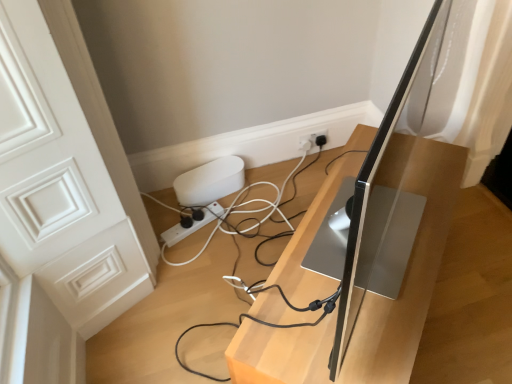
Question: Considering the relative sizes of silver metallic monitor at center and white plastic power strip at lower center in the image provided, is silver metallic monitor at center wider than white plastic power strip at lower center?

Choices:
 (A) yes
 (B) no

Answer: (A)

Question: From a real-world perspective, is silver metallic monitor at center physically above white plastic power strip at lower center?

Choices:
 (A) no
 (B) yes

Answer: (B)

Question: Is silver metallic monitor at center at the right side of white plastic power strip at lower center?

Choices:
 (A) no
 (B) yes

Answer: (B)

Question: Does silver metallic monitor at center lie behind white plastic power strip at lower center?

Choices:
 (A) yes
 (B) no

Answer: (B)

Question: From the image's perspective, is silver metallic monitor at center beneath white plastic power strip at lower center?

Choices:
 (A) yes
 (B) no

Answer: (A)

Question: Is silver metallic monitor at center at the left side of white plastic power strip at lower center?

Choices:
 (A) no
 (B) yes

Answer: (A)

Question: Can you confirm if silver metallic computer monitor at center is taller than silver metallic monitor at center?

Choices:
 (A) no
 (B) yes

Answer: (B)

Question: From the image's perspective, is silver metallic computer monitor at center on top of silver metallic monitor at center?

Choices:
 (A) yes
 (B) no

Answer: (A)

Question: Can we say silver metallic computer monitor at center lies outside silver metallic monitor at center?

Choices:
 (A) yes
 (B) no

Answer: (A)

Question: From a real-world perspective, is silver metallic computer monitor at center physically above silver metallic monitor at center?

Choices:
 (A) yes
 (B) no

Answer: (A)

Question: Is silver metallic computer monitor at center oriented towards silver metallic monitor at center?

Choices:
 (A) no
 (B) yes

Answer: (A)

Question: Considering the relative sizes of silver metallic computer monitor at center and silver metallic monitor at center in the image provided, is silver metallic computer monitor at center smaller than silver metallic monitor at center?

Choices:
 (A) no
 (B) yes

Answer: (B)

Question: From the image's perspective, is silver metallic monitor at center located above silver metallic computer monitor at center?

Choices:
 (A) no
 (B) yes

Answer: (A)